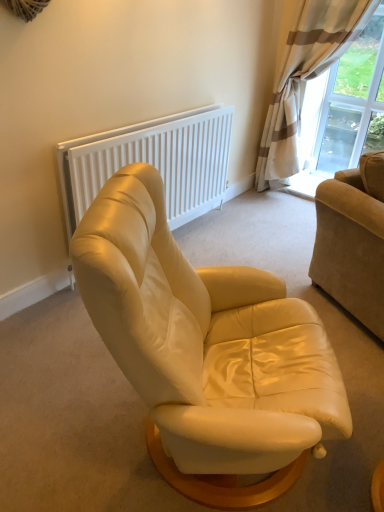
Describe the element at coordinates (353, 101) in the screenshot. I see `transparent glass window at upper right` at that location.

This screenshot has height=512, width=384. What do you see at coordinates (353, 240) in the screenshot?
I see `beige corduroy couch at right` at bounding box center [353, 240].

What do you see at coordinates (206, 351) in the screenshot? The image size is (384, 512). I see `matte cream leather armchair at center` at bounding box center [206, 351].

This screenshot has width=384, height=512. I want to click on white matte radiator at upper center, so click(153, 162).

Can you tell me how much white matte radiator at upper center and beige striped curtain at upper right differ in facing direction?

The angular difference between white matte radiator at upper center and beige striped curtain at upper right is 88.9 degrees.

Which object is positioned more to the left, white matte radiator at upper center or beige striped curtain at upper right?

Positioned to the left is white matte radiator at upper center.

Where is `curtain located behind the white matte radiator at upper center`? Image resolution: width=384 pixels, height=512 pixels. curtain located behind the white matte radiator at upper center is located at coordinates (304, 76).

Would you say white matte radiator at upper center is outside beige striped curtain at upper right?

That's correct, white matte radiator at upper center is outside of beige striped curtain at upper right.

From a real-world perspective, is beige striped curtain at upper right physically located above or below matte cream leather armchair at center?

beige striped curtain at upper right is situated higher than matte cream leather armchair at center in the real world.

You are a GUI agent. You are given a task and a screenshot of the screen. Output one action in this format:
    pyautogui.click(x=<x>, y=<y>)
    Task: Click on the curtain that is behind the matte cream leather armchair at center
    The image size is (384, 512).
    Given the screenshot: What is the action you would take?
    pyautogui.click(x=304, y=76)

From the image's perspective, which is above, beige striped curtain at upper right or matte cream leather armchair at center?

From the image's view, beige striped curtain at upper right is above.

Is matte cream leather armchair at center inside beige striped curtain at upper right?

Answer: No, beige striped curtain at upper right does not contain matte cream leather armchair at center.

Where is `chair directly beneath the beige corduroy couch at right (from a real-world perspective)`? This screenshot has height=512, width=384. chair directly beneath the beige corduroy couch at right (from a real-world perspective) is located at coordinates (206, 351).

Based on their positions, is beige corduroy couch at right located to the left or right of matte cream leather armchair at center?

Clearly, beige corduroy couch at right is on the right of matte cream leather armchair at center in the image.

Which is behind, point (332, 270) or point (209, 303)?

The point (332, 270) is farther.

Can you tell me how much beige corduroy couch at right and matte cream leather armchair at center differ in facing direction?

115 degrees.

Considering their positions, is transparent glass window at upper right located in front of or behind matte cream leather armchair at center?

Clearly, transparent glass window at upper right is behind matte cream leather armchair at center.

Could you tell me if transparent glass window at upper right is turned towards matte cream leather armchair at center?

Yes, transparent glass window at upper right is turned towards matte cream leather armchair at center.

Considering the positions of point (375, 40) and point (110, 342), is point (375, 40) closer or farther from the camera than point (110, 342)?

Clearly, point (375, 40) is more distant from the camera than point (110, 342).

How many degrees apart are the facing directions of transparent glass window at upper right and matte cream leather armchair at center?

The facing directions of transparent glass window at upper right and matte cream leather armchair at center are 179 degrees apart.

Based on their sizes in the image, would you say matte cream leather armchair at center is bigger or smaller than beige corduroy couch at right?

Clearly, matte cream leather armchair at center is smaller in size than beige corduroy couch at right.

What are the coordinates of `chair that is under the beige corduroy couch at right (from a real-world perspective)` in the screenshot? It's located at (206, 351).

From the image's perspective, which is above, matte cream leather armchair at center or beige corduroy couch at right?

beige corduroy couch at right appears higher in the image.

Is matte cream leather armchair at center wider than white matte radiator at upper center?

Correct, the width of matte cream leather armchair at center exceeds that of white matte radiator at upper center.

Is matte cream leather armchair at center positioned behind white matte radiator at upper center?

No, it is not.

Consider the image. From the image's perspective, relative to white matte radiator at upper center, is matte cream leather armchair at center above or below?

From the image's perspective, matte cream leather armchair at center appears below white matte radiator at upper center.

Which of these two, matte cream leather armchair at center or transparent glass window at upper right, is bigger?

With larger size is matte cream leather armchair at center.

Is matte cream leather armchair at center positioned with its back to transparent glass window at upper right?

No, matte cream leather armchair at center is not facing the opposite direction of transparent glass window at upper right.

From the image's perspective, between matte cream leather armchair at center and transparent glass window at upper right, which one is located above?

From the image's view, transparent glass window at upper right is above.

Identify the location of curtain that appears behind the white matte radiator at upper center. The height and width of the screenshot is (512, 384). (304, 76).

Find the location of `curtain that appears on the right of matte cream leather armchair at center`. curtain that appears on the right of matte cream leather armchair at center is located at coordinates (304, 76).

Which object lies further to the anchor point beige striped curtain at upper right, beige corduroy couch at right or matte cream leather armchair at center?

Among the two, matte cream leather armchair at center is located further to beige striped curtain at upper right.

From the image, which object appears to be nearer to beige striped curtain at upper right, matte cream leather armchair at center or white matte radiator at upper center?

The object closer to beige striped curtain at upper right is white matte radiator at upper center.

Looking at the image, which one is located closer to beige corduroy couch at right, beige striped curtain at upper right or transparent glass window at upper right?

Based on the image, beige striped curtain at upper right appears to be nearer to beige corduroy couch at right.

Looking at the image, which one is located further to beige striped curtain at upper right, beige corduroy couch at right or white matte radiator at upper center?

beige corduroy couch at right is further to beige striped curtain at upper right.

From the image, which object appears to be nearer to white matte radiator at upper center, matte cream leather armchair at center or beige striped curtain at upper right?

Among the two, beige striped curtain at upper right is located nearer to white matte radiator at upper center.

Looking at the image, which one is located closer to transparent glass window at upper right, matte cream leather armchair at center or beige striped curtain at upper right?

Based on the image, beige striped curtain at upper right appears to be nearer to transparent glass window at upper right.

Estimate the real-world distances between objects in this image. Which object is further from transparent glass window at upper right, white matte radiator at upper center or matte cream leather armchair at center?

The object further to transparent glass window at upper right is matte cream leather armchair at center.

Considering their positions, is beige corduroy couch at right positioned further to white matte radiator at upper center than matte cream leather armchair at center?

matte cream leather armchair at center.

The image size is (384, 512). I want to click on studio couch located between matte cream leather armchair at center and beige striped curtain at upper right in the depth direction, so click(x=353, y=240).

The height and width of the screenshot is (512, 384). Find the location of `curtain positioned between beige corduroy couch at right and transparent glass window at upper right from near to far`. curtain positioned between beige corduroy couch at right and transparent glass window at upper right from near to far is located at coordinates (x=304, y=76).

Where is `radiator positioned between matte cream leather armchair at center and beige striped curtain at upper right from near to far`? The width and height of the screenshot is (384, 512). radiator positioned between matte cream leather armchair at center and beige striped curtain at upper right from near to far is located at coordinates click(x=153, y=162).

Find the location of a particular element. Image resolution: width=384 pixels, height=512 pixels. chair situated between white matte radiator at upper center and beige corduroy couch at right from left to right is located at coordinates (206, 351).